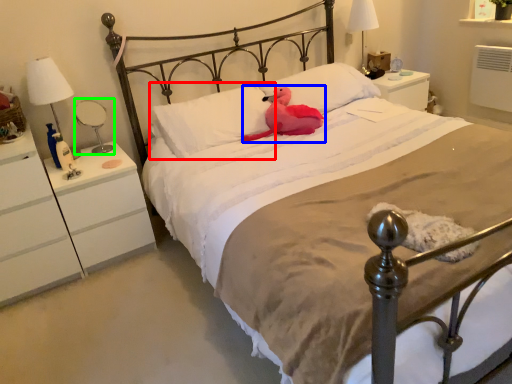
Question: Based on their relative distances, which object is nearer to pillow (highlighted by a red box)? Choose from animal (highlighted by a blue box) and bedside lamp (highlighted by a green box).

Choices:
 (A) animal
 (B) bedside lamp

Answer: (A)